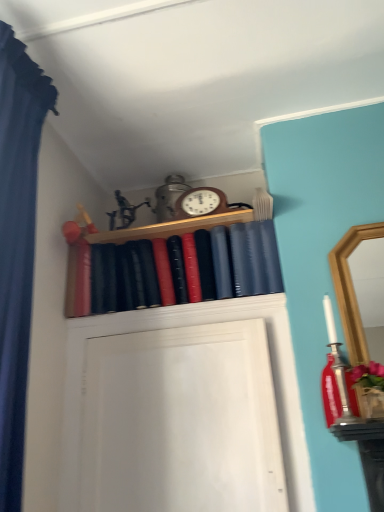
Describe the element at coordinates (169, 263) in the screenshot. This screenshot has height=512, width=384. I see `matte leather books at upper center` at that location.

Where is `matte leather books at upper center`? matte leather books at upper center is located at coordinates (169, 263).

This screenshot has height=512, width=384. Find the location of `matte leather books at upper center`. matte leather books at upper center is located at coordinates (169, 263).